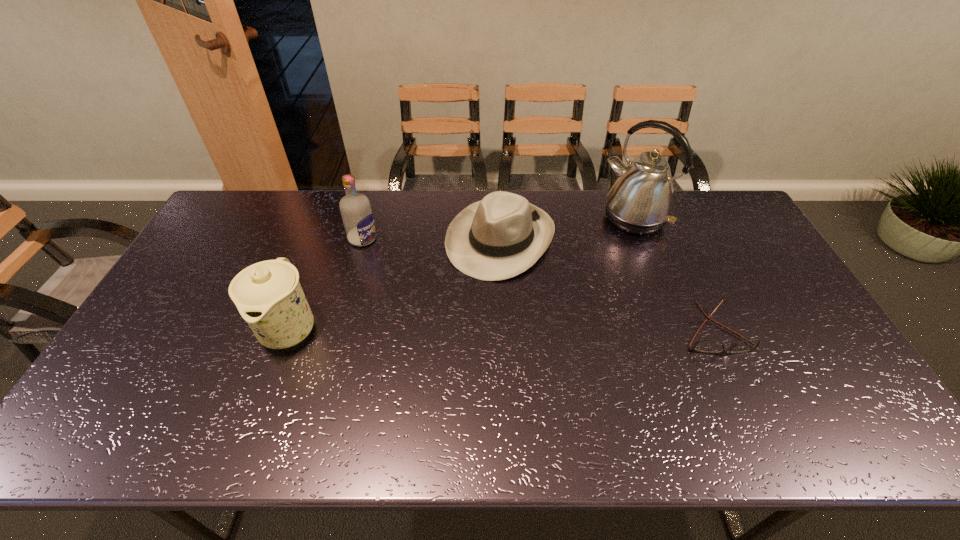
Locate an element on the screen. The height and width of the screenshot is (540, 960). chinaware is located at coordinates (268, 295).

Locate an element on the screen. This screenshot has width=960, height=540. the shortest object is located at coordinates (712, 346).

The width and height of the screenshot is (960, 540). Find the location of `the tallest object`. the tallest object is located at coordinates (641, 200).

I want to click on vodka, so click(355, 208).

Locate an element on the screen. This screenshot has height=540, width=960. fedora is located at coordinates (501, 236).

The height and width of the screenshot is (540, 960). Find the location of `the third object from left to right`. the third object from left to right is located at coordinates (501, 236).

Identify the location of vacant space located 0.080m on the front-facing side of the spectacles. The width and height of the screenshot is (960, 540). (737, 382).

Where is `vacant space positioned 0.370m from the spout of the kettle`? vacant space positioned 0.370m from the spout of the kettle is located at coordinates (557, 295).

Image resolution: width=960 pixels, height=540 pixels. What are the coordinates of `vacant space located 0.140m from the spout of the kettle` in the screenshot? It's located at (597, 255).

Where is `blank space located from the spout of the kettle`? blank space located from the spout of the kettle is located at coordinates (592, 260).